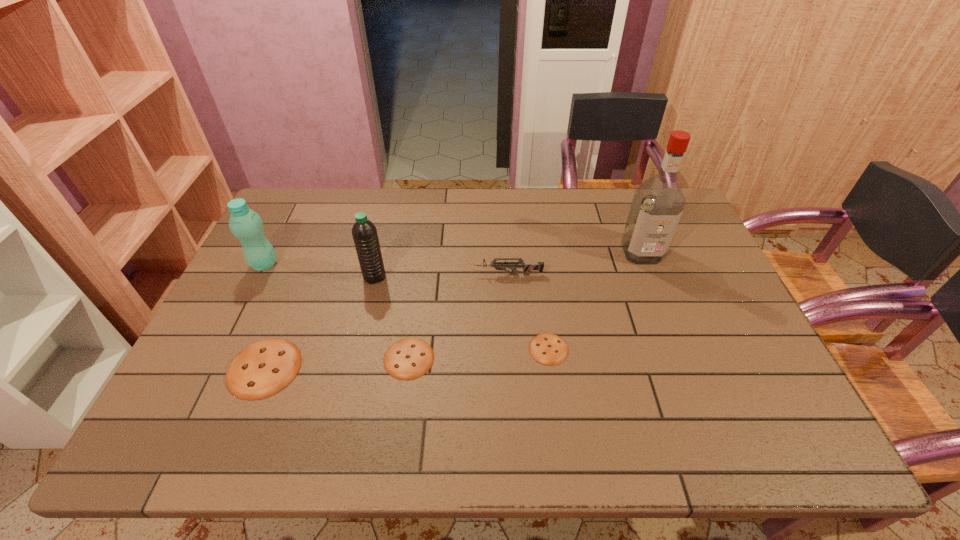
Identify the location of bottle. Image resolution: width=960 pixels, height=540 pixels. (x=246, y=225).

This screenshot has height=540, width=960. In order to click on vacant space located on the back of the leftmost cookie in this screenshot , I will do `click(308, 259)`.

Locate an element on the screen. The height and width of the screenshot is (540, 960). vacant space located on the right of the second cookie from right to left is located at coordinates (455, 359).

Locate an element on the screen. free location located on the back of the shortest object is located at coordinates (537, 262).

This screenshot has height=540, width=960. Find the location of `free region located aimed along the barrel of the fourth shortest object`. free region located aimed along the barrel of the fourth shortest object is located at coordinates (382, 274).

You are a GUI agent. You are given a task and a screenshot of the screen. Output one action in this format:
    pyautogui.click(x=<x>, y=<y>)
    Task: Click on the vacant space located 0.280m aimed along the barrel of the fourth shortest object
    
    Given the screenshot: What is the action you would take?
    pyautogui.click(x=379, y=274)

This screenshot has width=960, height=540. Find the location of `vacant space situated aimed along the barrel of the fourth shortest object`. vacant space situated aimed along the barrel of the fourth shortest object is located at coordinates (454, 274).

Where is `vacant space positioned on the back of the water bottle`? The width and height of the screenshot is (960, 540). vacant space positioned on the back of the water bottle is located at coordinates (394, 199).

Identify the location of free region located 0.320m on the front-facing side of the tallest object. (682, 354).

This screenshot has height=540, width=960. I want to click on free space located 0.290m on the back of the bottle, so click(x=297, y=200).